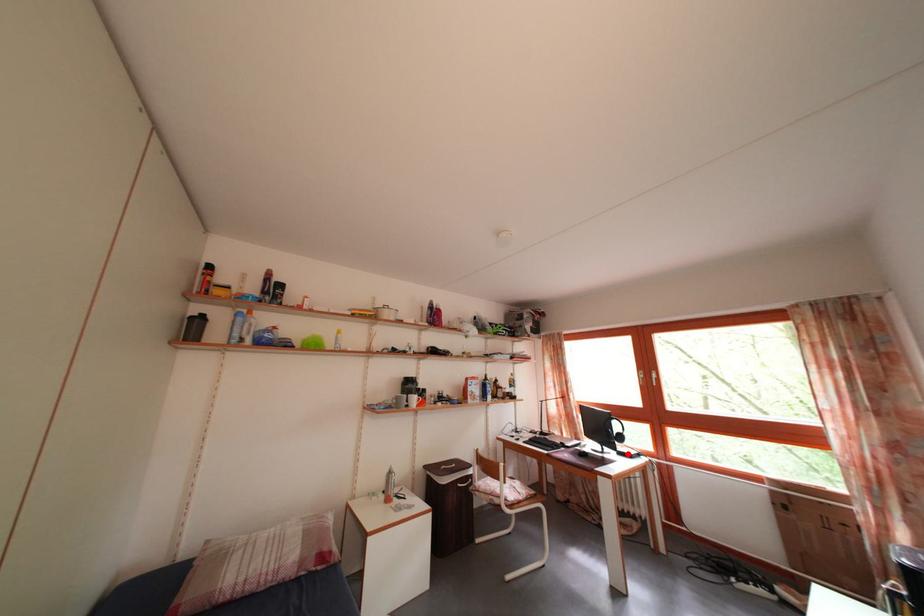
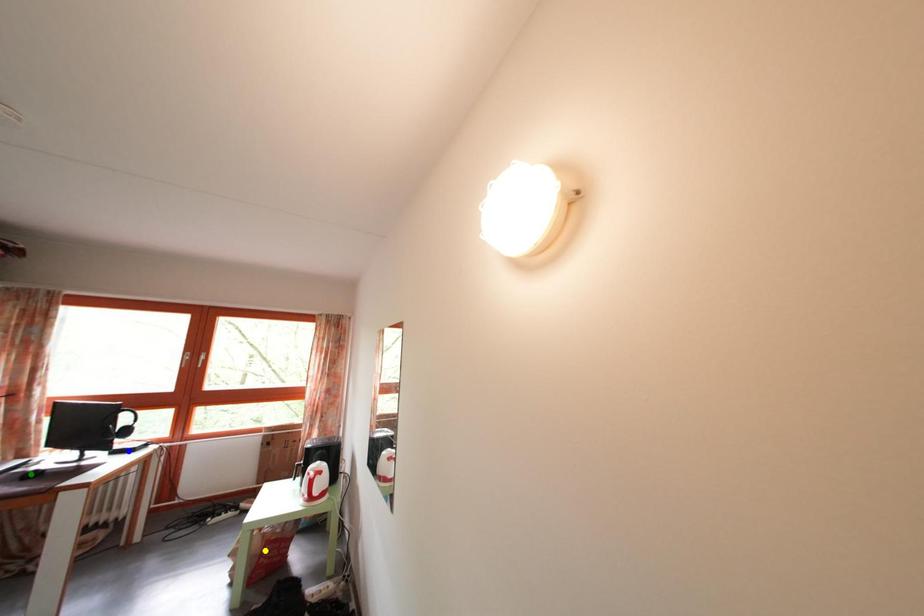
Question: I am providing you with two images of the same scene from different viewpoints. A red point is marked on the first image. You are given multiple points on the second image. Which mark in image 2 goes with the point in image 1?

Choices:
 (A) yellow point
 (B) blue point
 (C) green point

Answer: (B)